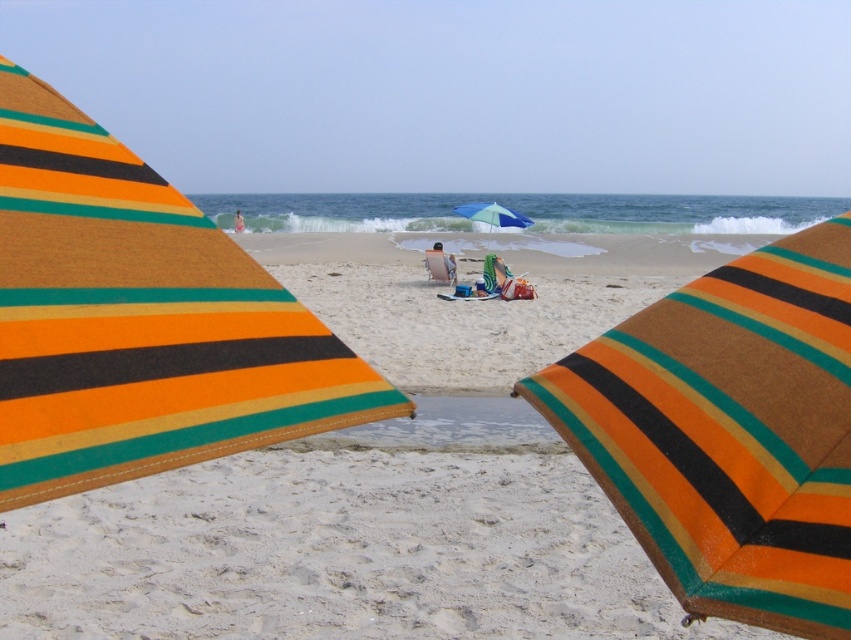
Is orange striped towel at center below orange striped fabric umbrella at center?

Incorrect, orange striped towel at center is not positioned below orange striped fabric umbrella at center.

Can you confirm if orange striped towel at center is positioned to the left of orange striped fabric umbrella at center?

Correct, you'll find orange striped towel at center to the left of orange striped fabric umbrella at center.

What do you see at coordinates (140, 320) in the screenshot? I see `orange striped towel at center` at bounding box center [140, 320].

Identify the location of orange striped towel at center. The image size is (851, 640). (140, 320).

Does point (837, 237) come closer to viewer compared to point (443, 252)?

Yes, point (837, 237) is in front of point (443, 252).

Does point (665, 467) come behind point (450, 278)?

That is False.

Between point (808, 230) and point (446, 272), which one is positioned in front?

Positioned in front is point (808, 230).

Locate an element on the screen. This screenshot has width=851, height=640. orange striped fabric umbrella at center is located at coordinates (728, 433).

Can you confirm if matte striped umbrella at center is smaller than orange striped towel at center?

Incorrect, matte striped umbrella at center is not smaller in size than orange striped towel at center.

You are a GUI agent. You are given a task and a screenshot of the screen. Output one action in this format:
    pyautogui.click(x=<x>, y=<y>)
    Task: Click on the matte striped umbrella at center
    The image size is (851, 640).
    Given the screenshot: What is the action you would take?
    pyautogui.click(x=337, y=554)

Which is behind, point (689, 352) or point (275, 385)?

The point (689, 352) is behind.

Locate an element on the screen. matte striped umbrella at center is located at coordinates (337, 554).